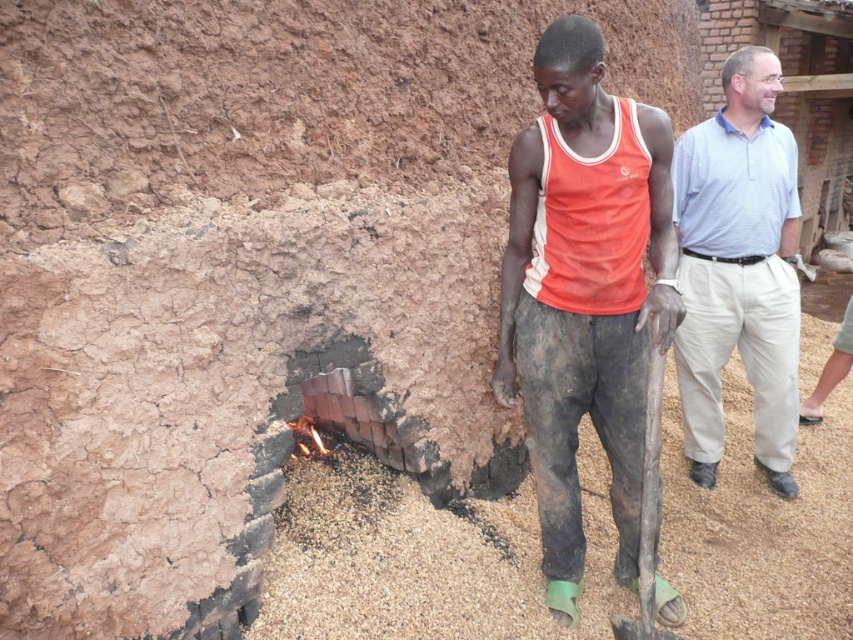
Question: Which of the following is the closest to the observer?

Choices:
 (A) matte orange tank top at center
 (B) light blue cotton shirt at upper right

Answer: (A)

Question: Does matte orange tank top at center have a smaller size compared to light blue cotton shirt at upper right?

Choices:
 (A) yes
 (B) no

Answer: (B)

Question: Can you confirm if light blue striped shirt at right is positioned to the left of light blue cotton shirt at upper right?

Choices:
 (A) yes
 (B) no

Answer: (B)

Question: Is matte orange tank top at center to the left of light blue cotton shirt at upper right from the viewer's perspective?

Choices:
 (A) no
 (B) yes

Answer: (B)

Question: Which object is closer to the camera taking this photo?

Choices:
 (A) light blue striped shirt at right
 (B) matte orange tank top at center

Answer: (B)

Question: Estimate the real-world distances between objects in this image. Which object is closer to the matte orange tank top at center?

Choices:
 (A) light blue striped shirt at right
 (B) light blue cotton shirt at upper right

Answer: (A)